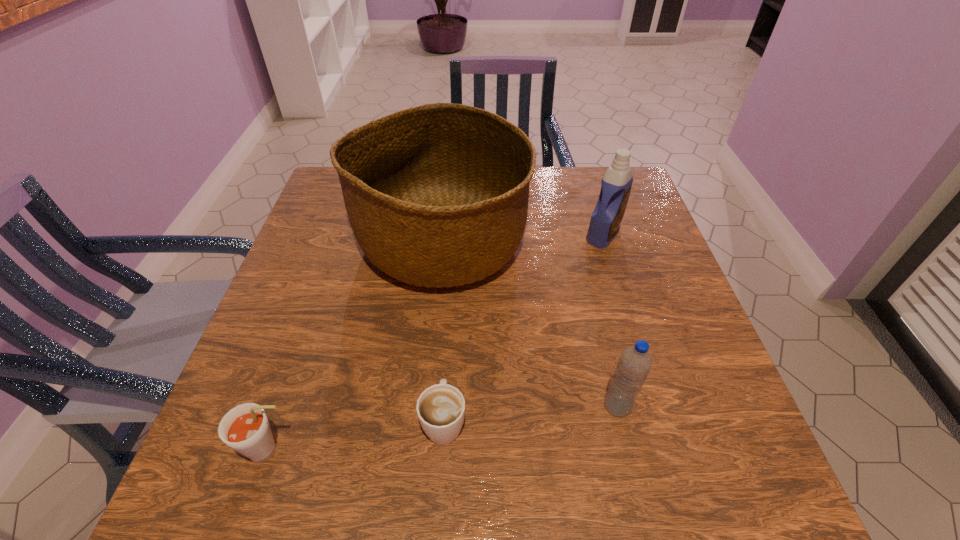
Locate an element on the screen. This screenshot has width=960, height=540. vacant area located 0.150m with the handle on the side of the shortest object is located at coordinates (449, 333).

Identify the location of vacant space situated with the handle on the side of the shortest object. (453, 272).

The height and width of the screenshot is (540, 960). I want to click on object at the far edge, so click(437, 195).

Locate an element on the screen. This screenshot has width=960, height=540. object that is at the near edge is located at coordinates (245, 428).

Where is `basket that is at the left edge`? basket that is at the left edge is located at coordinates (437, 195).

Where is `root beer situated at the left edge`? The width and height of the screenshot is (960, 540). root beer situated at the left edge is located at coordinates (245, 428).

Find the location of a particular element. Image resolution: width=960 pixels, height=540 pixels. object that is at the right edge is located at coordinates (616, 184).

The height and width of the screenshot is (540, 960). Identify the location of object located at the far left corner. (437, 195).

This screenshot has height=540, width=960. I want to click on object that is at the near left corner, so click(245, 428).

Find the location of a particular element. Image resolution: width=960 pixels, height=540 pixels. vacant space at the far edge of the desktop is located at coordinates (563, 174).